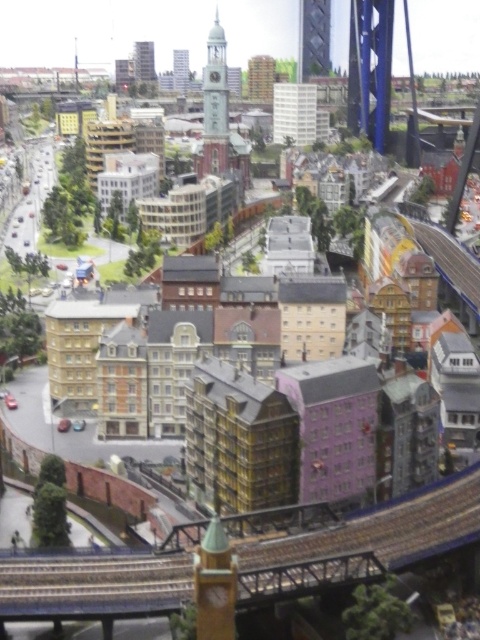
Is gold metallic clock tower at center taller than smooth white clock tower at upper center?

Correct, gold metallic clock tower at center is much taller as smooth white clock tower at upper center.

From the picture: Does gold metallic clock tower at center have a larger size compared to smooth white clock tower at upper center?

Correct, gold metallic clock tower at center is larger in size than smooth white clock tower at upper center.

Where is `gold metallic clock tower at center`? This screenshot has height=640, width=480. gold metallic clock tower at center is located at coordinates (215, 104).

Where is `gold metallic clock tower at center`? The width and height of the screenshot is (480, 640). gold metallic clock tower at center is located at coordinates (215, 104).

Measure the distance from shiny glass tower at upper center to metallic silver tower at upper center.

A distance of 306.75 feet exists between shiny glass tower at upper center and metallic silver tower at upper center.

This screenshot has height=640, width=480. I want to click on shiny glass tower at upper center, so click(x=313, y=38).

This screenshot has width=480, height=640. Identify the location of shiny glass tower at upper center. (313, 38).

Is gold metallic clock tower at center wider than shiny glass tower at upper center?

In fact, gold metallic clock tower at center might be narrower than shiny glass tower at upper center.

In the scene shown: Is gold metallic clock tower at center to the right of shiny glass tower at upper center from the viewer's perspective?

In fact, gold metallic clock tower at center is to the left of shiny glass tower at upper center.

Find the location of `gold metallic clock tower at center`. gold metallic clock tower at center is located at coordinates (215, 104).

Locate an element on the screen. Image resolution: width=480 pixels, height=640 pixels. gold metallic clock tower at center is located at coordinates (215, 104).